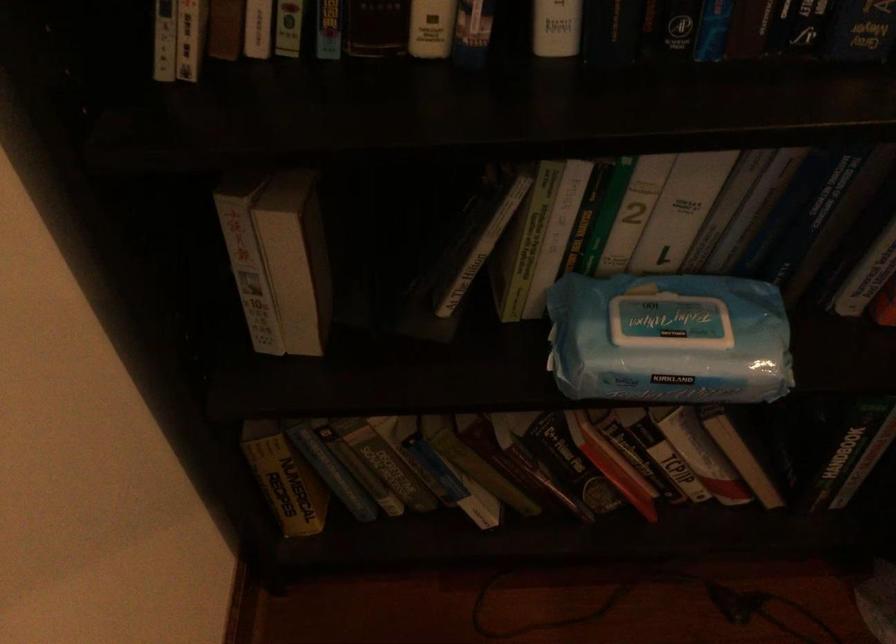
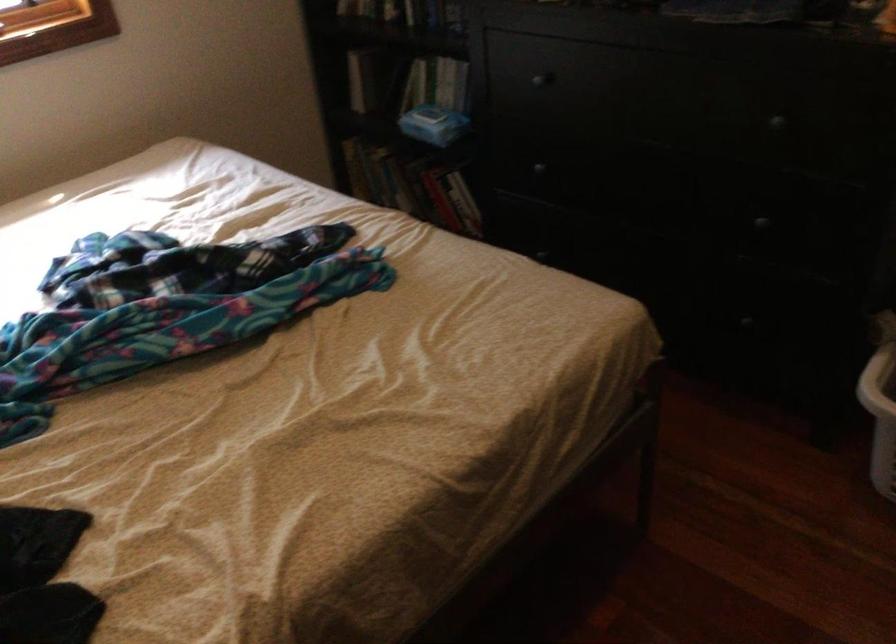
Where in the second image is the point corresponding to point (372, 460) from the first image?

(380, 175)